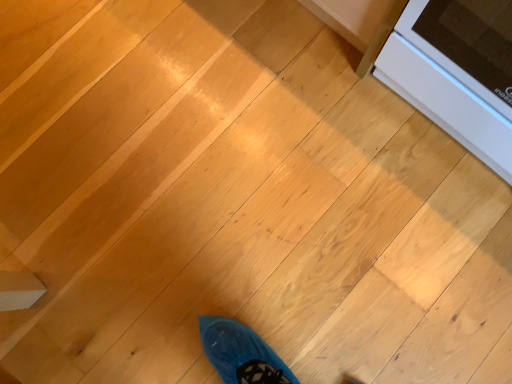
The image size is (512, 384). Describe the element at coordinates (457, 71) in the screenshot. I see `white glossy oven at upper right` at that location.

This screenshot has width=512, height=384. Identify the location of white glossy oven at upper right. (457, 71).

What is the approximate height of white glossy oven at upper right?

The height of white glossy oven at upper right is 18.84 inches.

Identify the location of white glossy oven at upper right. The image size is (512, 384). (457, 71).